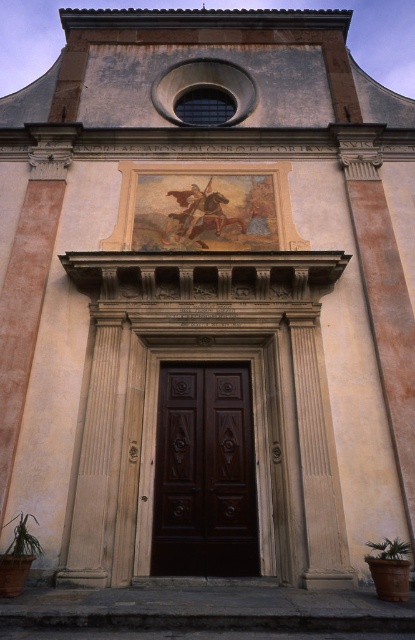
You are an architect planning to install a new door in a similar style to the dark wood door at center. The space you have available is exactly the same width as the green leafy plant at lower right. Will the new door fit in that space?

The dark wood door at center is wider than the green leafy plant at lower right. Therefore, the new door will not fit in the space allocated as it is wider than the available space.

You are standing in front of the classical building and want to enter through the dark wood door at center. To your left, there is a green leafy plant at lower left. Which direction should you move to reach the door from the plant?

The dark wood door at center is positioned on the right side of green leafy plant at lower left, so you should move to the right from the plant to reach the door.

You are standing in front of the classical building and want to locate two specific points marked on the facade. The first point is at coordinate point (253, 496) and the second is at point (12, 541). Which point is closer to the entrance?

Point (12, 541) is closer to the entrance because it is in front of point (253, 496).